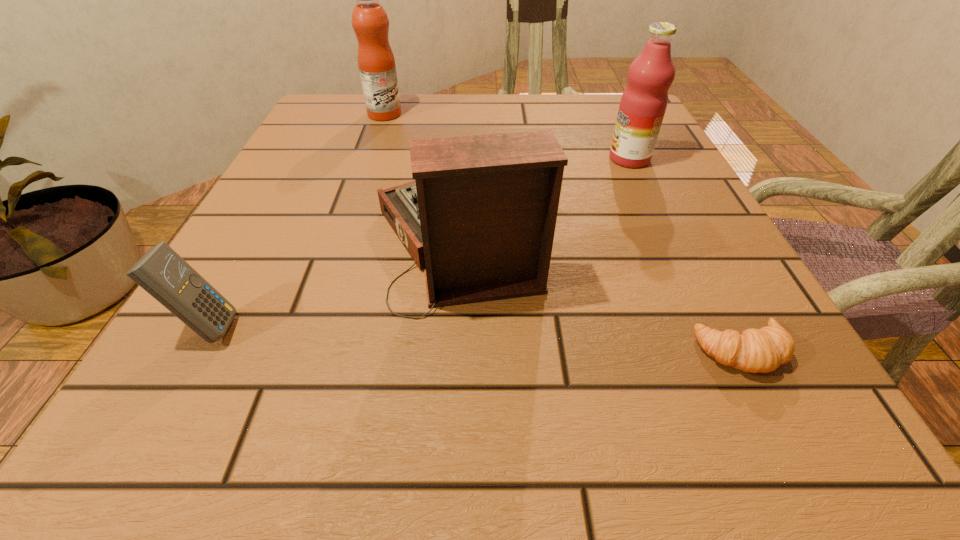
Locate an element on the screen. free location located 0.270m on the label of the right fruit juice is located at coordinates (476, 159).

The height and width of the screenshot is (540, 960). I want to click on free point located on the label of the right fruit juice, so click(452, 159).

You are a GUI agent. You are given a task and a screenshot of the screen. Output one action in this format:
    pyautogui.click(x=<x>, y=<y>)
    Task: Click on the free space located 0.340m on the back of the phonograph record
    This screenshot has width=960, height=540.
    Given the screenshot: What is the action you would take?
    pyautogui.click(x=466, y=104)

Find the location of a particular element. Image resolution: width=960 pixels, height=540 pixels. vacant space situated 0.100m on the front-facing side of the leftmost object is located at coordinates (312, 326).

Identify the location of vacant space located 0.370m on the back of the crescent roll. (653, 176).

Where is `object that is at the far edge`? The width and height of the screenshot is (960, 540). object that is at the far edge is located at coordinates coord(376,62).

You are a GUI agent. You are given a task and a screenshot of the screen. Output one action in this format:
    pyautogui.click(x=<x>, y=<y>)
    Task: Click on the fruit juice located in the left edge section of the desktop
    The width and height of the screenshot is (960, 540).
    Given the screenshot: What is the action you would take?
    tap(376, 62)

I want to click on calculator located in the left edge section of the desktop, so click(166, 276).

Locate an element on the screen. fruit juice situated at the right edge is located at coordinates (643, 104).

You are a GUI agent. You are given a task and a screenshot of the screen. Output one action in this format:
    pyautogui.click(x=<x>, y=<y>)
    Task: Click on the crescent roll situated at the right edge
    
    Given the screenshot: What is the action you would take?
    pos(762,350)